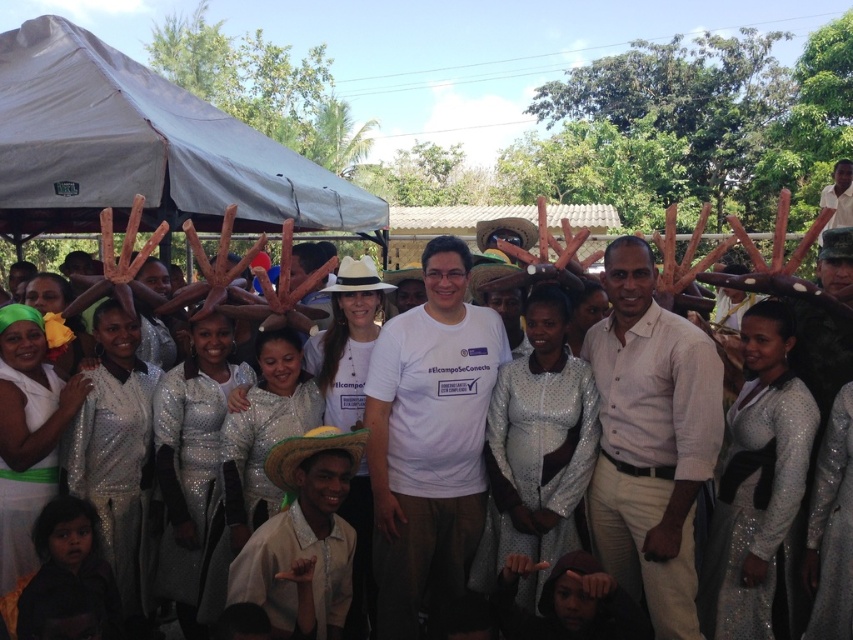
Looking at this image, does white fabric canopy at upper left have a greater width compared to white matte t-shirt at center?

No, white fabric canopy at upper left is not wider than white matte t-shirt at center.

Find the location of `white fabric canopy at upper left`. white fabric canopy at upper left is located at coordinates (142, 147).

This screenshot has height=640, width=853. In order to click on white fabric canopy at upper left in this screenshot , I will do `click(142, 147)`.

Between point (15, 35) and point (604, 538), which one is positioned behind?

Positioned behind is point (15, 35).

Where is `white fabric canopy at upper left`? white fabric canopy at upper left is located at coordinates (142, 147).

Can you confirm if white matte t-shirt at center is positioned to the left of light beige cotton shirt at center?

Correct, you'll find white matte t-shirt at center to the left of light beige cotton shirt at center.

Which is behind, point (427, 604) or point (631, 275)?

Positioned behind is point (427, 604).

Is point (408, 628) in front of point (628, 285)?

No, it is not.

The image size is (853, 640). What are the coordinates of `white matte t-shirt at center` in the screenshot? It's located at (428, 442).